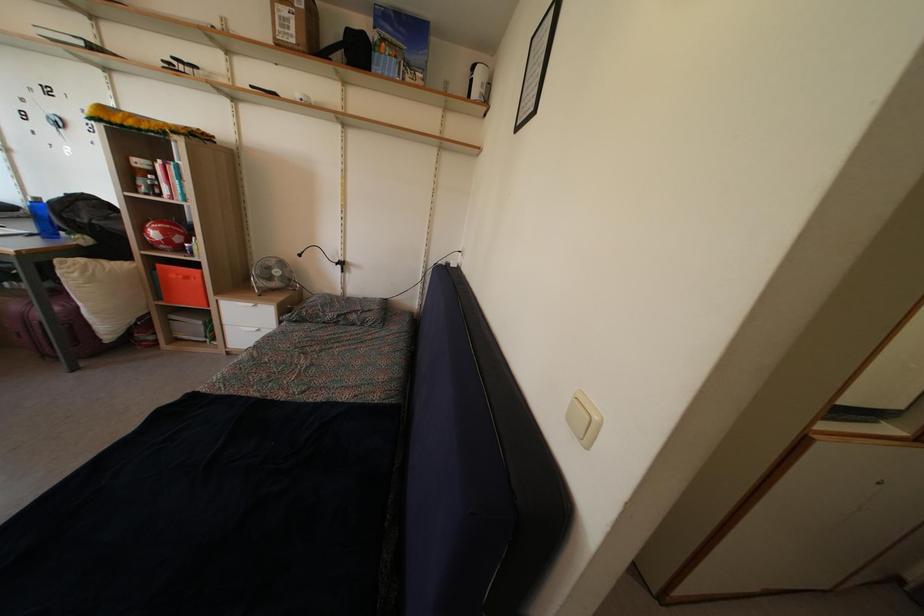
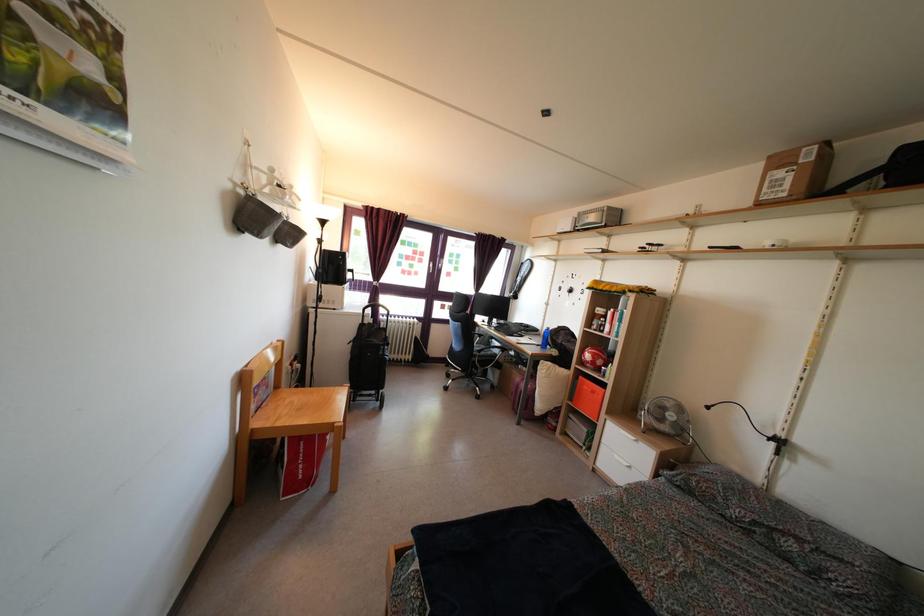
Question: The camera is either moving clockwise (left) or counter-clockwise (right) around the object. The first image is from the beginning of the video and the second image is from the end. Is the camera moving left or right when shooting the video?

Choices:
 (A) Left
 (B) Right

Answer: (B)